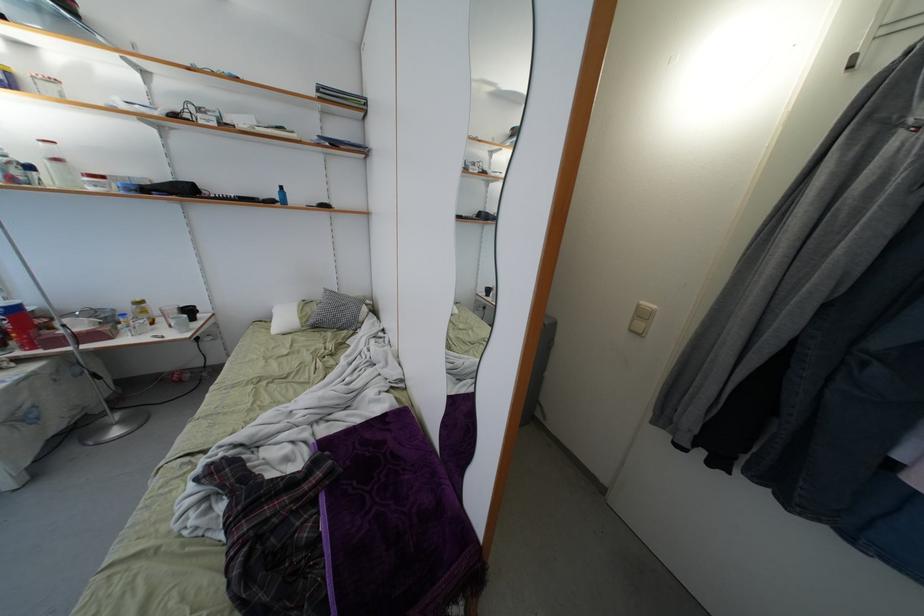
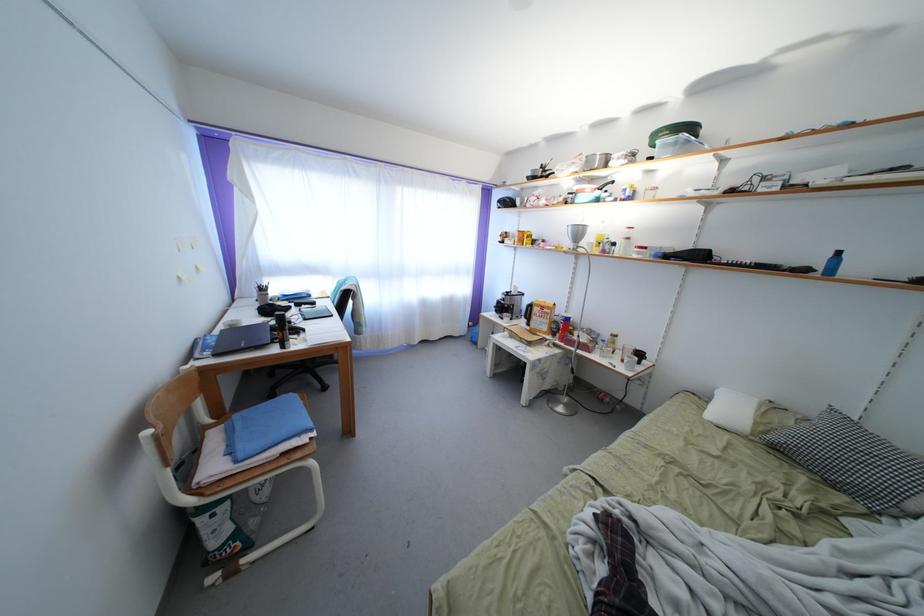
Locate, in the second image, the point that corresponds to (x=285, y=207) in the first image.

(823, 272)